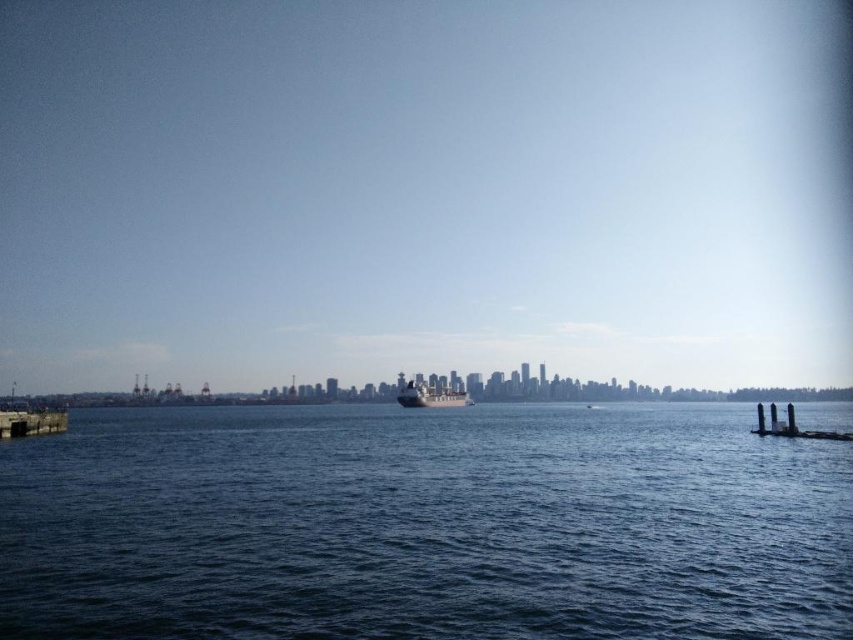
You are a sailor navigating a small boat and want to pass between the blue water at center and the metallic gray ship at center. Which direction should you steer your boat to avoid the ship?

The blue water at center is positioned on the left side of the metallic gray ship at center, so you should steer your boat to the right of the metallic gray ship at center to avoid it.

You are a delivery person who needs to place a heavy crate on the concrete pier at lower left. However, you notice that the pier is over the smooth concrete pillars at lower right. Is the pier stable enough to hold the crate?

The concrete pier at lower left is positioned over the smooth concrete pillars at lower right, so it is likely stable enough to hold the crate as it is supported by the pillars.